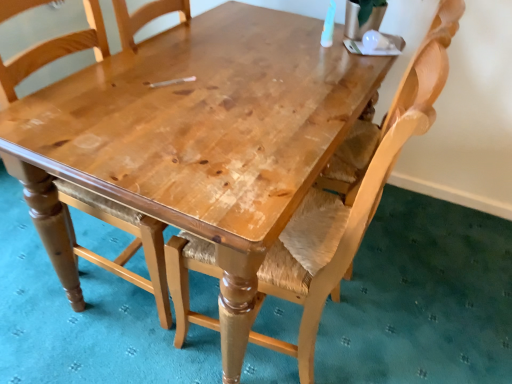
Question: In the image, is wooden chair with woven seat at center, the 1th chair when ordered from right to left, positioned in front of or behind light brown wood chair at center, positioned as the 1th chair in left-to-right order?

Choices:
 (A) front
 (B) behind

Answer: (A)

Question: From a real-world perspective, is wooden chair with woven seat at center, the 1th chair when ordered from right to left, physically located above or below light brown wood chair at center, the 2th chair viewed from the right?

Choices:
 (A) above
 (B) below

Answer: (A)

Question: Considering the positions of point (215, 273) and point (142, 233), is point (215, 273) closer or farther from the camera than point (142, 233)?

Choices:
 (A) farther
 (B) closer

Answer: (B)

Question: From the image's perspective, relative to wooden chair with woven seat at center, the 1th chair when ordered from right to left, is light brown wood chair at center, positioned as the 1th chair in left-to-right order, above or below?

Choices:
 (A) below
 (B) above

Answer: (B)

Question: From a real-world perspective, is light brown wood chair at center, positioned as the 1th chair in left-to-right order, physically located above or below wooden chair with woven seat at center, the 2th chair from the left?

Choices:
 (A) below
 (B) above

Answer: (A)

Question: Considering the relative positions of light brown wood chair at center, the 2th chair viewed from the right, and wooden chair with woven seat at center, the 2th chair from the left, in the image provided, is light brown wood chair at center, the 2th chair viewed from the right, to the left or to the right of wooden chair with woven seat at center, the 2th chair from the left,?

Choices:
 (A) right
 (B) left

Answer: (B)

Question: From their relative heights in the image, would you say light brown wood chair at center, positioned as the 1th chair in left-to-right order, is taller or shorter than wooden chair with woven seat at center, the 1th chair when ordered from right to left?

Choices:
 (A) short
 (B) tall

Answer: (B)